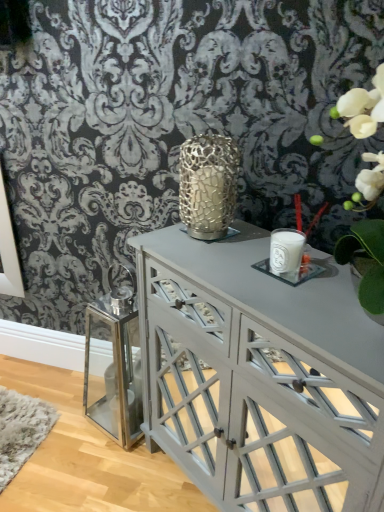
Where is `free space above matte gray cabinet at center (from a real-world perspective)`? Image resolution: width=384 pixels, height=512 pixels. free space above matte gray cabinet at center (from a real-world perspective) is located at coordinates (269, 279).